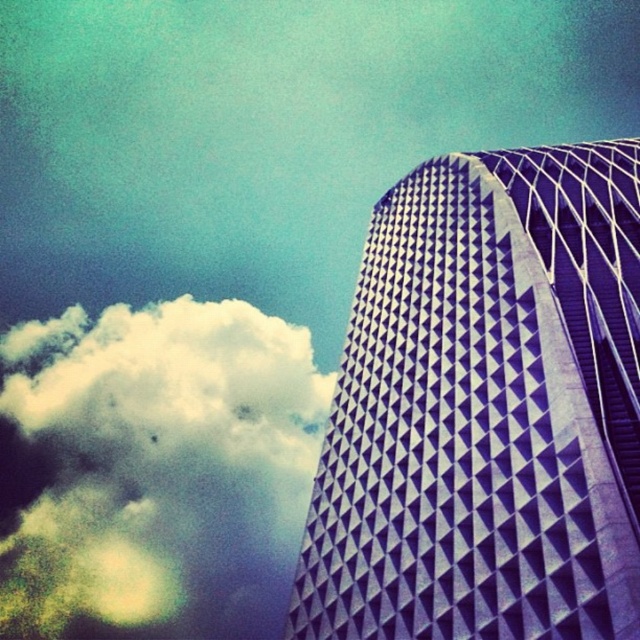
Question: Is purple textured building at right to the right of white fluffy cloud at upper left from the viewer's perspective?

Choices:
 (A) no
 (B) yes

Answer: (B)

Question: Considering the relative positions of purple textured building at right and white fluffy cloud at upper left in the image provided, where is purple textured building at right located with respect to white fluffy cloud at upper left?

Choices:
 (A) above
 (B) below

Answer: (A)

Question: Does purple textured building at right have a smaller size compared to white fluffy cloud at upper left?

Choices:
 (A) yes
 (B) no

Answer: (A)

Question: Which of the following is the farthest from the observer?

Choices:
 (A) purple textured building at right
 (B) white fluffy cloud at upper left

Answer: (B)

Question: Which object is closer to the camera taking this photo?

Choices:
 (A) purple textured building at right
 (B) white fluffy cloud at upper left

Answer: (A)